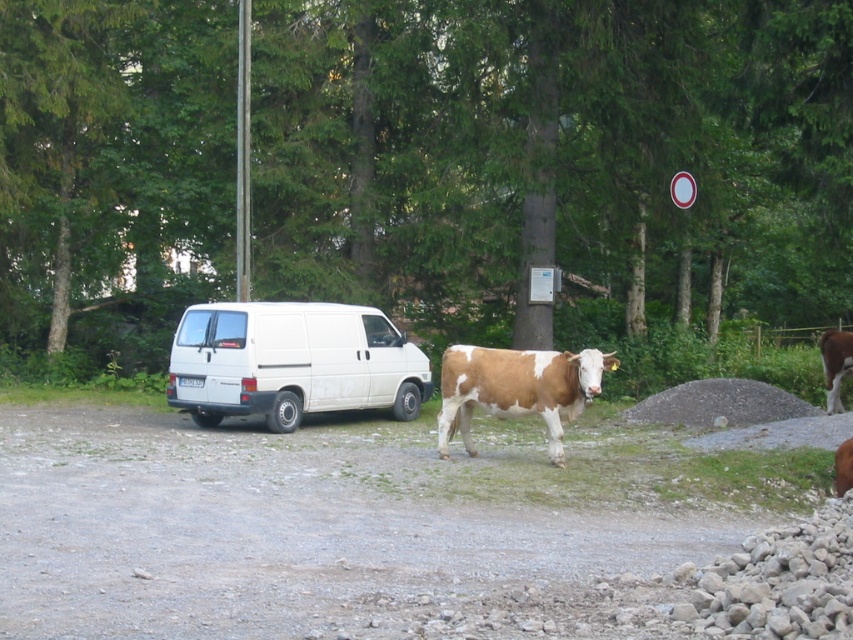
Can you confirm if white matte van at left is wider than brown and white textured cow at center?

Indeed, white matte van at left has a greater width compared to brown and white textured cow at center.

Is point (231, 385) positioned behind point (585, 384)?

Yes.

Image resolution: width=853 pixels, height=640 pixels. Find the location of `white matte van at left`. white matte van at left is located at coordinates (292, 362).

Between point (614, 362) and point (821, 360), which one is positioned in front?

Point (614, 362)

The image size is (853, 640). Identify the location of brown and white textured cow at center. (515, 388).

At what (x,y) coordinates should I click in order to perform the action: click on brown and white textured cow at center. Please return your answer as a coordinate pair (x, y). The width and height of the screenshot is (853, 640). Looking at the image, I should click on (515, 388).

Who is more distant from viewer, (204, 413) or (837, 410)?

Positioned behind is point (837, 410).

Consider the image. Does white matte van at left have a larger size compared to brown speckled hide at right?

Incorrect, white matte van at left is not larger than brown speckled hide at right.

This screenshot has height=640, width=853. What do you see at coordinates (292, 362) in the screenshot? I see `white matte van at left` at bounding box center [292, 362].

Image resolution: width=853 pixels, height=640 pixels. I want to click on white matte van at left, so click(x=292, y=362).